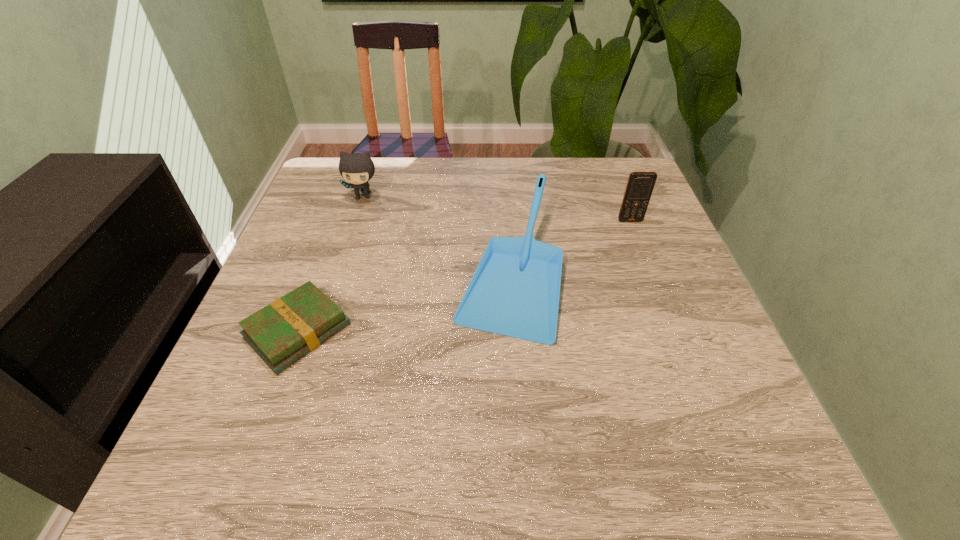
Find the location of `cellular telephone`. cellular telephone is located at coordinates (640, 185).

The height and width of the screenshot is (540, 960). Find the location of `kitten`. kitten is located at coordinates (356, 168).

Where is `dustpan`? dustpan is located at coordinates coord(515,290).

In order to click on book in this screenshot , I will do `click(281, 333)`.

The image size is (960, 540). I want to click on vacant region located on the screen of the cellular telephone, so click(671, 325).

Locate an element on the screen. This screenshot has width=960, height=540. vacant space located 0.070m on the front-facing side of the farthest object is located at coordinates (355, 220).

Locate an element on the screen. This screenshot has height=540, width=960. blank space located 0.200m on the back of the third object from left to right is located at coordinates (502, 172).

The width and height of the screenshot is (960, 540). I want to click on free region located 0.240m on the right of the book, so click(x=471, y=331).

This screenshot has width=960, height=540. In order to click on object that is at the far edge in this screenshot , I will do `click(356, 168)`.

Where is `kitten at the left edge`? The image size is (960, 540). kitten at the left edge is located at coordinates (356, 168).